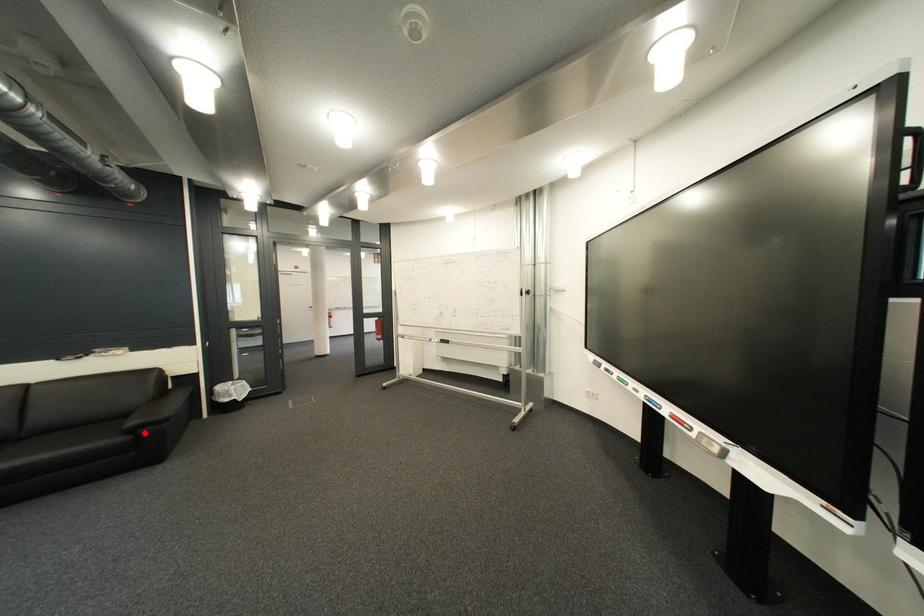
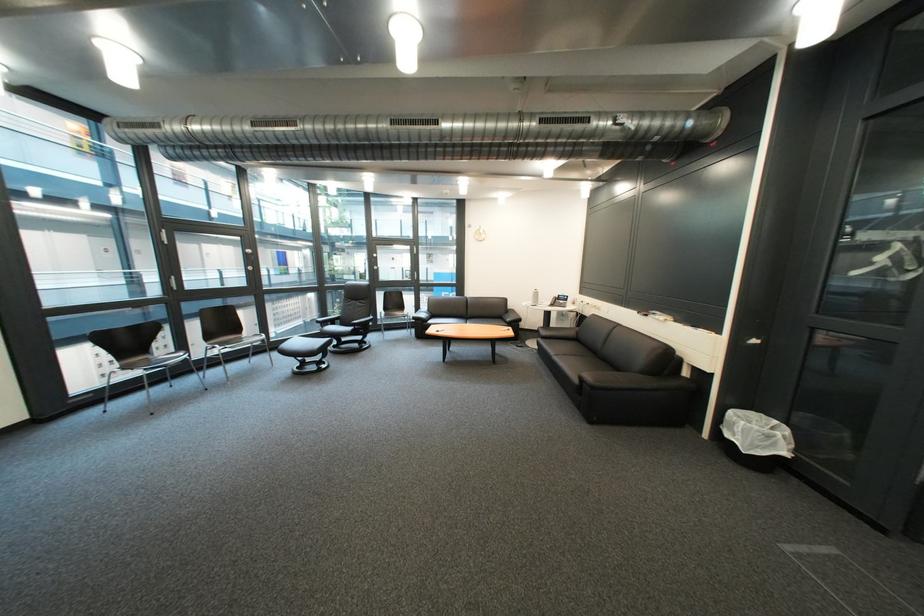
The point at the highlighted location is marked in the first image. Where is the corresponding point in the second image?

(594, 381)